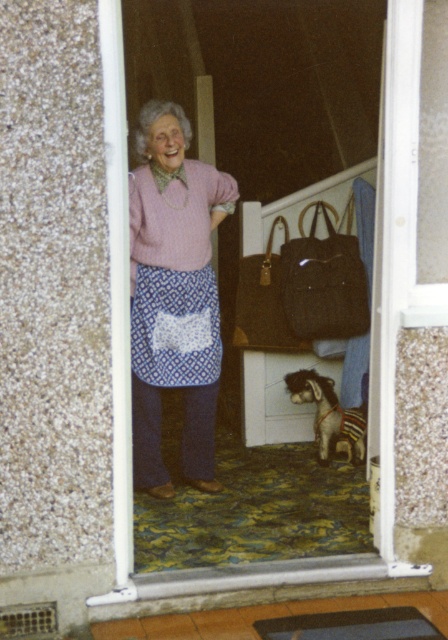
Which is behind, point (155, 170) or point (335, 234)?

The point (335, 234) is more distant.

Who is positioned more to the left, pink knitted sweater at center or brown woven bag at center?

pink knitted sweater at center

Which is behind, point (158, 440) or point (323, 204)?

The point (323, 204) is more distant.

Image resolution: width=448 pixels, height=640 pixels. Find the location of `pink knitted sweater at center`. pink knitted sweater at center is located at coordinates (173, 296).

Does brown woven bag at center appear on the left side of brown plush dog at lower center?

Correct, you'll find brown woven bag at center to the left of brown plush dog at lower center.

Which of these two, brown woven bag at center or brown plush dog at lower center, stands taller?

With more height is brown woven bag at center.

Who is more distant from viewer, (310, 317) or (317, 400)?

The point (310, 317) is behind.

I want to click on brown woven bag at center, so click(x=323, y=282).

Does pink knitted sweater at center come in front of transparent plastic screen door at center?

No, it is behind transparent plastic screen door at center.

From the picture: Between pink knitted sweater at center and transparent plastic screen door at center, which one appears on the left side from the viewer's perspective?

pink knitted sweater at center is more to the left.

Image resolution: width=448 pixels, height=640 pixels. I want to click on pink knitted sweater at center, so [x=173, y=296].